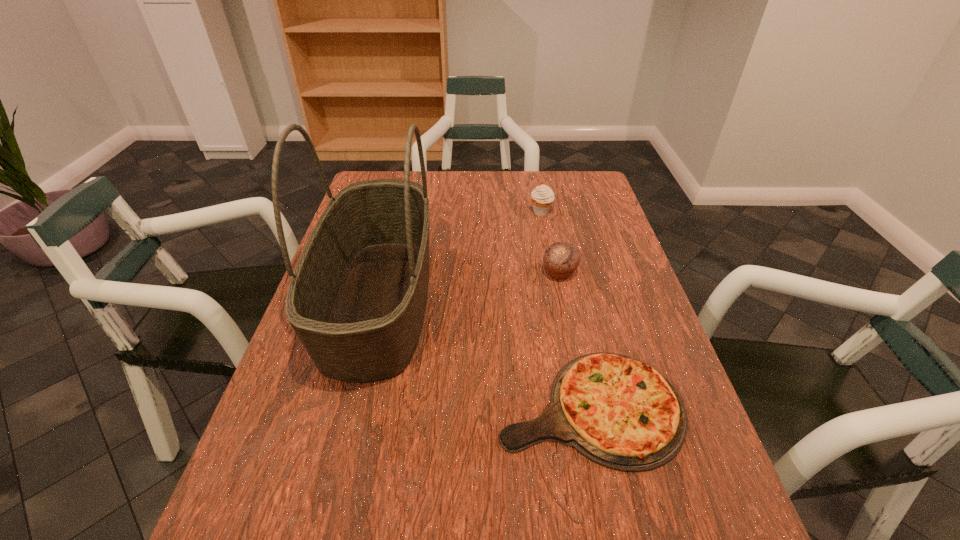
You are a GUI agent. You are given a task and a screenshot of the screen. Output one action in this format:
    pyautogui.click(x=<x>, y=<y>)
    Task: Click on the object that is at the far edge
    The width and height of the screenshot is (960, 540).
    Given the screenshot: What is the action you would take?
    [542, 196]

Locate an element on the screen. The height and width of the screenshot is (540, 960). object situated at the left edge is located at coordinates (357, 298).

Image resolution: width=960 pixels, height=540 pixels. Find the location of `muffin present at the right edge`. muffin present at the right edge is located at coordinates (561, 259).

Identify the location of pizza that is at the right edge. The height and width of the screenshot is (540, 960). (615, 410).

Identify the location of free space at the far edge of the desktop. The height and width of the screenshot is (540, 960). (545, 184).

You are a GUI agent. You are given a task and a screenshot of the screen. Output one action in this format:
    pyautogui.click(x=<x>, y=<y>)
    Task: Click on the vacant space at the left edge
    This screenshot has height=540, width=960.
    Given the screenshot: What is the action you would take?
    click(304, 444)

This screenshot has height=540, width=960. In the image, there is a desktop. Find the location of `vacant space at the right edge`. vacant space at the right edge is located at coordinates (634, 342).

Locate an element on the screen. The image size is (960, 540). free space between the shortest object and the leftmost object is located at coordinates (485, 354).

This screenshot has width=960, height=540. What are the coordinates of `vacant space in between the farther muffin and the second shortest object` in the screenshot? It's located at (550, 242).

What are the coordinates of `vacant area that lies between the farther muffin and the third tallest object` in the screenshot? It's located at (550, 242).